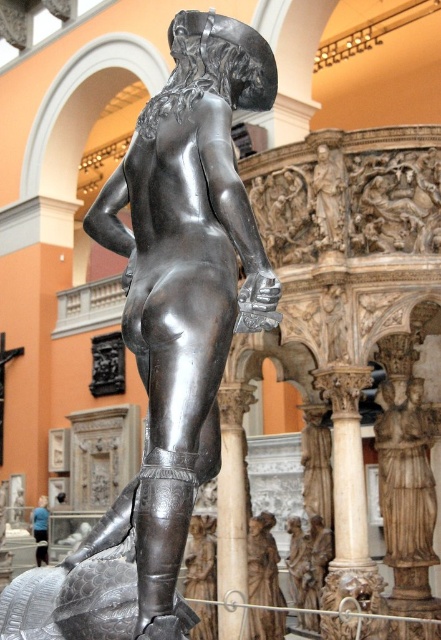
Between polished marble statue at center and smooth marble pillar at center, which one appears on the left side from the viewer's perspective?

From the viewer's perspective, smooth marble pillar at center appears more on the left side.

Is point (421, 452) closer to camera compared to point (232, 566)?

No, (421, 452) is further to viewer.

Identify the location of polished marble statue at center. (404, 477).

Is white marble column at center wider than polished marble statue at center?

Yes.

Does white marble column at center appear under polished marble statue at center?

Correct, white marble column at center is located below polished marble statue at center.

Does point (355, 440) come behind point (418, 502)?

That is False.

The width and height of the screenshot is (441, 640). Identify the location of white marble column at center. (348, 496).

Looking at this image, who is shorter, smooth marble pillar at center or blue fabric pants at lower left?

Standing shorter between the two is blue fabric pants at lower left.

Can you confirm if smooth marble pillar at center is smaller than blue fabric pants at lower left?

No.

Between point (230, 449) and point (37, 547), which one is positioned behind?

The point (37, 547) is behind.

Locate an element on the screen. The image size is (441, 640). smooth marble pillar at center is located at coordinates (231, 513).